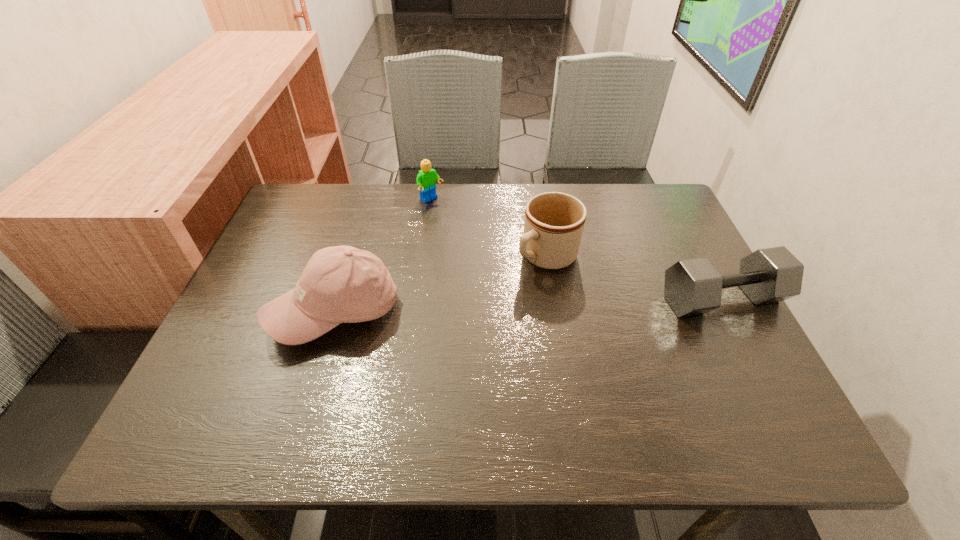
Locate which object is the second closest to the rightmost object. Please provide its 2D coordinates. Your answer should be formatted as a tuple, i.e. [(x, y)], where the tuple contains the x and y coordinates of a point satisfying the conditions above.

[(426, 179)]

Where is `object that stands as the second closest to the dumbbell`? This screenshot has width=960, height=540. object that stands as the second closest to the dumbbell is located at coordinates (426, 179).